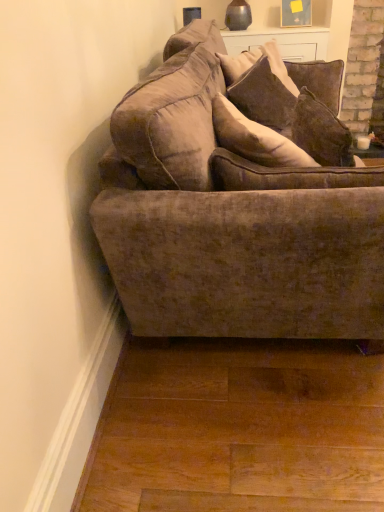
Question: Based on their positions, is velvet brown pillow at upper center, the second pillow when ordered from front to back, located to the left or right of velvet brown couch at center?

Choices:
 (A) left
 (B) right

Answer: (B)

Question: Considering the positions of velvet brown pillow at upper center, placed as the 1th pillow when sorted from back to front, and velvet brown couch at center in the image, is velvet brown pillow at upper center, placed as the 1th pillow when sorted from back to front, taller or shorter than velvet brown couch at center?

Choices:
 (A) tall
 (B) short

Answer: (B)

Question: Estimate the real-world distances between objects in this image. Which object is farther from the velvet brown pillow at upper center, the second pillow when ordered from front to back?

Choices:
 (A) velvet brown pillow at upper center, which is the first pillow in front-to-back order
 (B) velvet brown couch at center

Answer: (B)

Question: Considering the real-world distances, which object is closest to the velvet brown pillow at upper center, which is the first pillow in front-to-back order?

Choices:
 (A) velvet brown pillow at upper center, placed as the 1th pillow when sorted from back to front
 (B) velvet brown couch at center

Answer: (A)